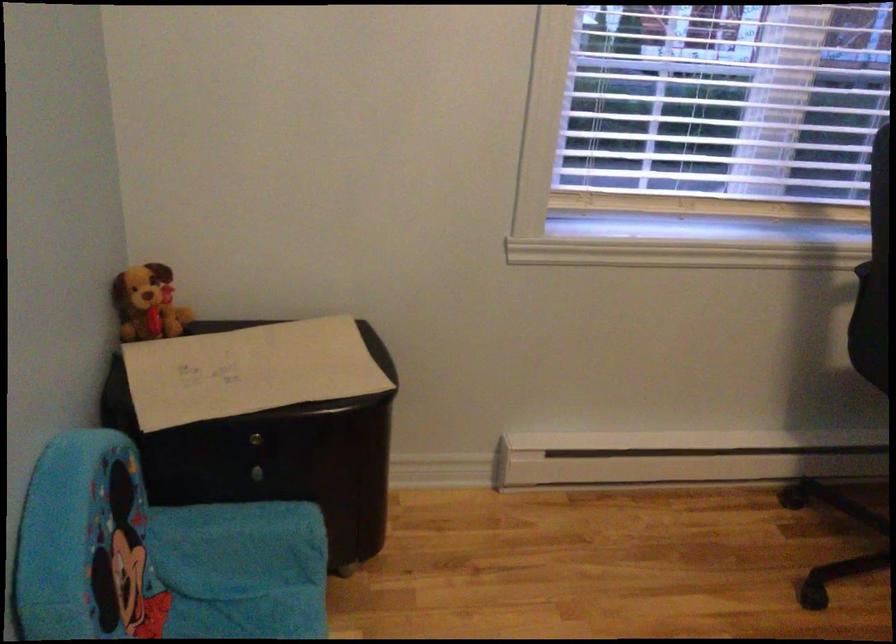
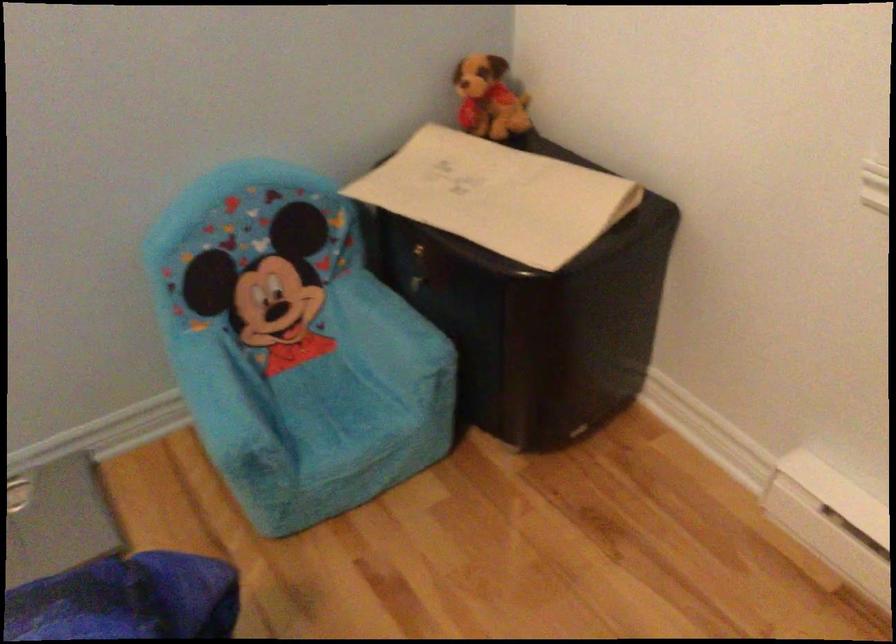
Find the pixel in the second image that matches point 268,368 in the first image.

(497, 196)